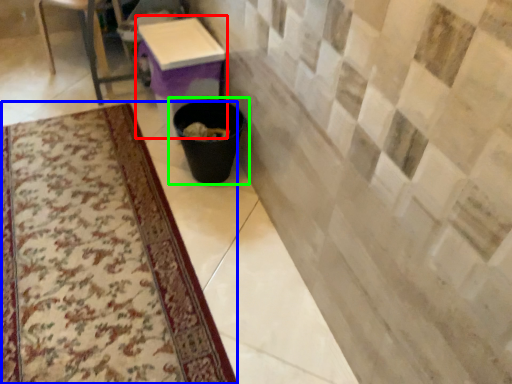
Question: Which is nearer to the table (highlighted by a red box)? mat (highlighted by a blue box) or waste container (highlighted by a green box).

Choices:
 (A) mat
 (B) waste container

Answer: (B)